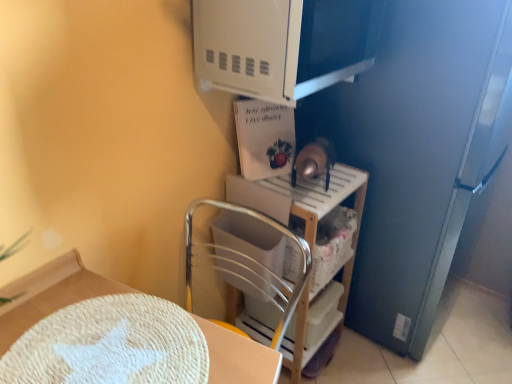
Question: Does white matte microwave at upper center appear on the right side of white woven placemat at lower left?

Choices:
 (A) no
 (B) yes

Answer: (B)

Question: Is white matte microwave at upper center aimed at white woven placemat at lower left?

Choices:
 (A) yes
 (B) no

Answer: (B)

Question: Is white matte microwave at upper center next to white woven placemat at lower left?

Choices:
 (A) yes
 (B) no

Answer: (B)

Question: Does white matte microwave at upper center appear on the left side of white woven placemat at lower left?

Choices:
 (A) yes
 (B) no

Answer: (B)

Question: Is the position of white matte microwave at upper center less distant than that of white woven placemat at lower left?

Choices:
 (A) yes
 (B) no

Answer: (B)

Question: In terms of size, does white matte microwave at upper center appear bigger or smaller than wooden shelf at center?

Choices:
 (A) big
 (B) small

Answer: (B)

Question: From a real-world perspective, is white matte microwave at upper center positioned above or below wooden shelf at center?

Choices:
 (A) above
 (B) below

Answer: (A)

Question: Is point (332, 39) positioned closer to the camera than point (287, 175)?

Choices:
 (A) closer
 (B) farther

Answer: (A)

Question: From the image's perspective, relative to wooden shelf at center, is white matte microwave at upper center above or below?

Choices:
 (A) below
 (B) above

Answer: (B)

Question: Is point (236, 215) positioned closer to the camera than point (195, 66)?

Choices:
 (A) farther
 (B) closer

Answer: (A)

Question: Is wooden shelf at center bigger or smaller than white matte microwave at upper center?

Choices:
 (A) small
 (B) big

Answer: (B)

Question: In the image, is wooden shelf at center on the left side or the right side of white matte microwave at upper center?

Choices:
 (A) left
 (B) right

Answer: (B)

Question: From a real-world perspective, relative to white matte microwave at upper center, is wooden shelf at center vertically above or below?

Choices:
 (A) below
 (B) above

Answer: (A)

Question: In terms of height, does wooden shelf at center look taller or shorter compared to white woven placemat at lower left?

Choices:
 (A) tall
 (B) short

Answer: (A)

Question: In the image, is wooden shelf at center positioned in front of or behind white woven placemat at lower left?

Choices:
 (A) front
 (B) behind

Answer: (B)